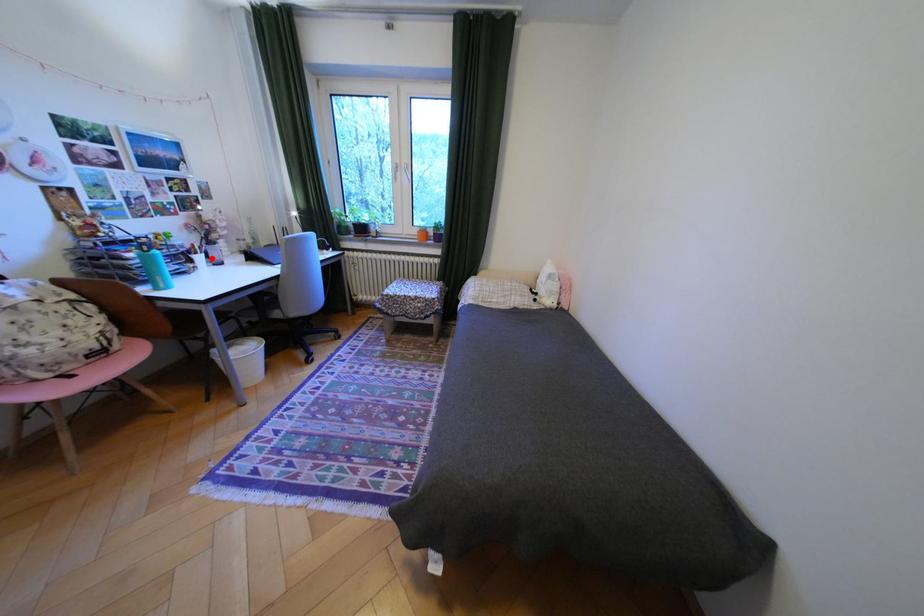
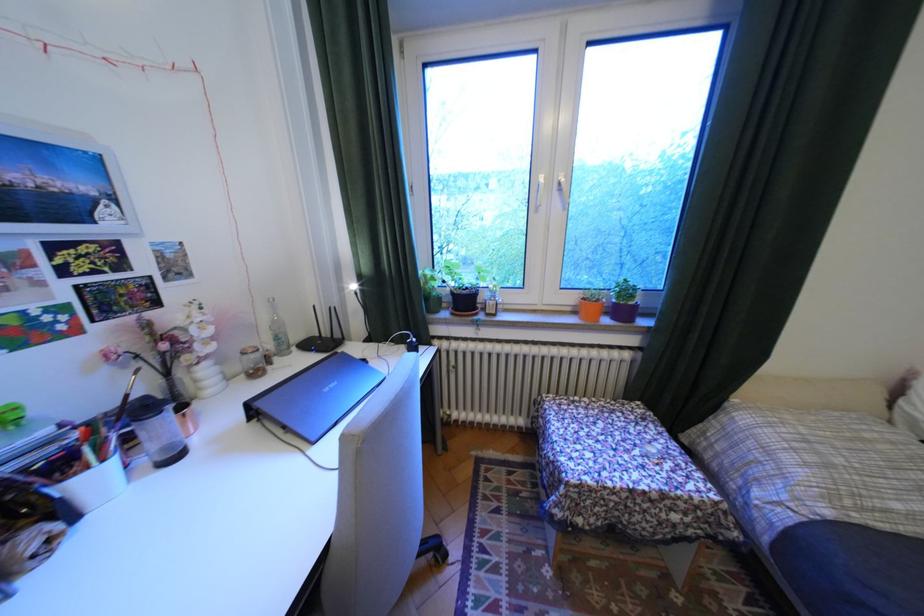
Question: I am providing you with two images of the same scene from different viewpoints. A red point is marked on the first image. At the location where the point appears in image 1, is it still visible in image 2?

Choices:
 (A) Yes
 (B) No

Answer: (A)